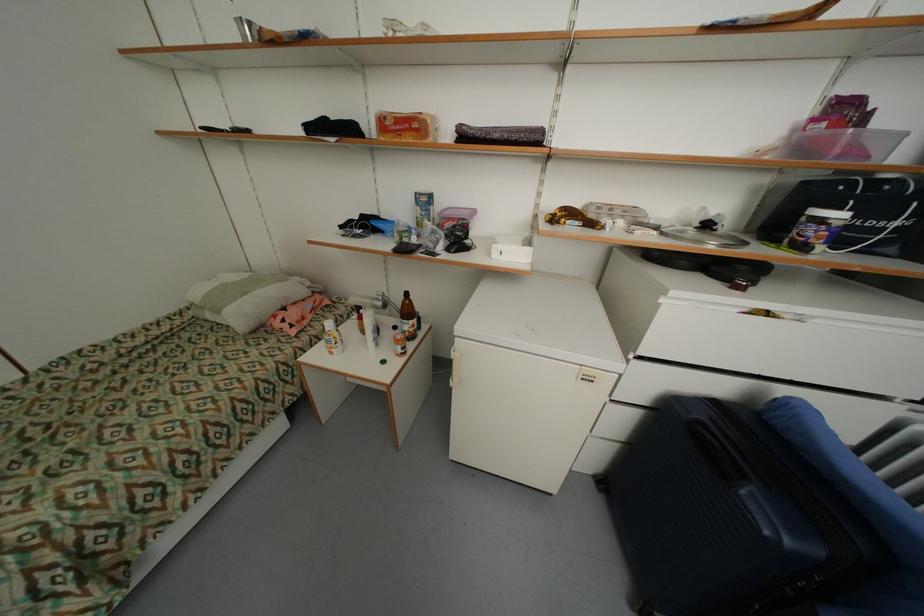
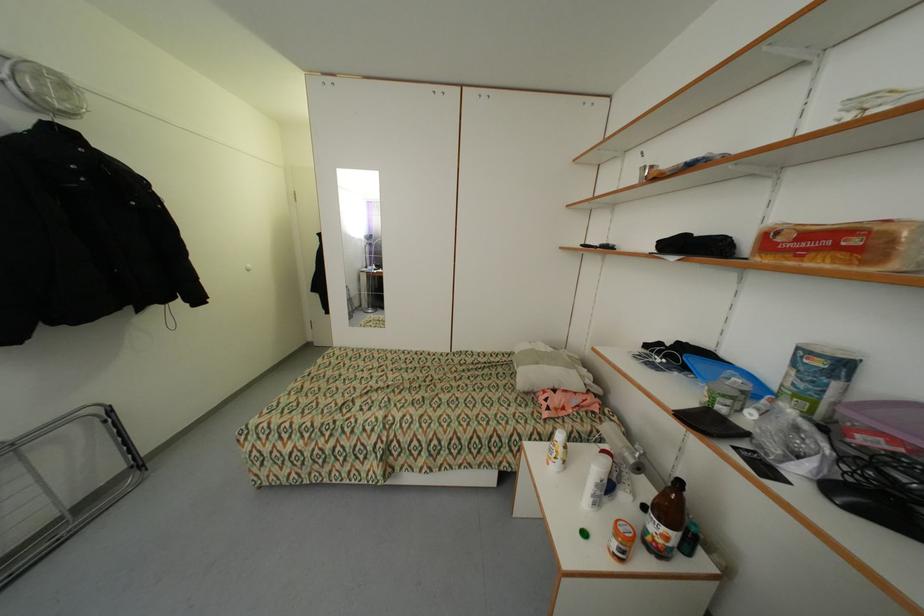
In the second image, find the point that corresponds to (x=419, y=326) in the first image.

(673, 540)